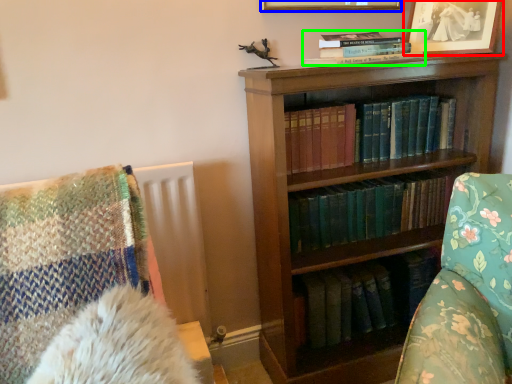
Question: Considering the real-world distances, which object is farthest from picture frame (highlighted by a red box)? picture frame (highlighted by a blue box) or book (highlighted by a green box)?

Choices:
 (A) picture frame
 (B) book

Answer: (B)